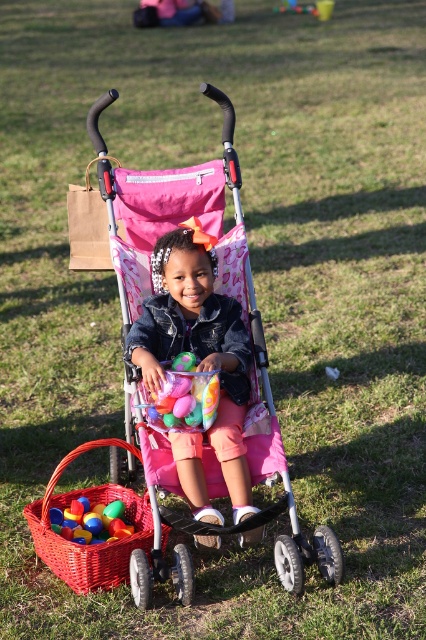
From the picture: Measure the distance from pink fabric stroller at center to translucent plastic eggs at center.

pink fabric stroller at center and translucent plastic eggs at center are 6.42 inches apart.

This screenshot has width=426, height=640. I want to click on pink fabric stroller at center, so coord(198,344).

Can you confirm if pink fabric baby carriage at center is bigger than translucent plastic eggs at center?

Correct, pink fabric baby carriage at center is larger in size than translucent plastic eggs at center.

Does pink fabric baby carriage at center have a lesser width compared to translucent plastic eggs at center?

Incorrect, pink fabric baby carriage at center's width is not less than translucent plastic eggs at center's.

Between point (129, 404) and point (178, 394), which one is positioned in front?

Positioned in front is point (178, 394).

Locate an element on the screen. The width and height of the screenshot is (426, 640). pink fabric baby carriage at center is located at coordinates (215, 288).

Measure the distance between bright red wicker basket at lower left and camera.

11.52 feet

Describe the element at coordinates (94, 545) in the screenshot. The height and width of the screenshot is (640, 426). I see `bright red wicker basket at lower left` at that location.

Is point (58, 477) farther from camera compared to point (95, 518)?

Yes, it is.

Where is `bright red wicker basket at lower left`? bright red wicker basket at lower left is located at coordinates (94, 545).